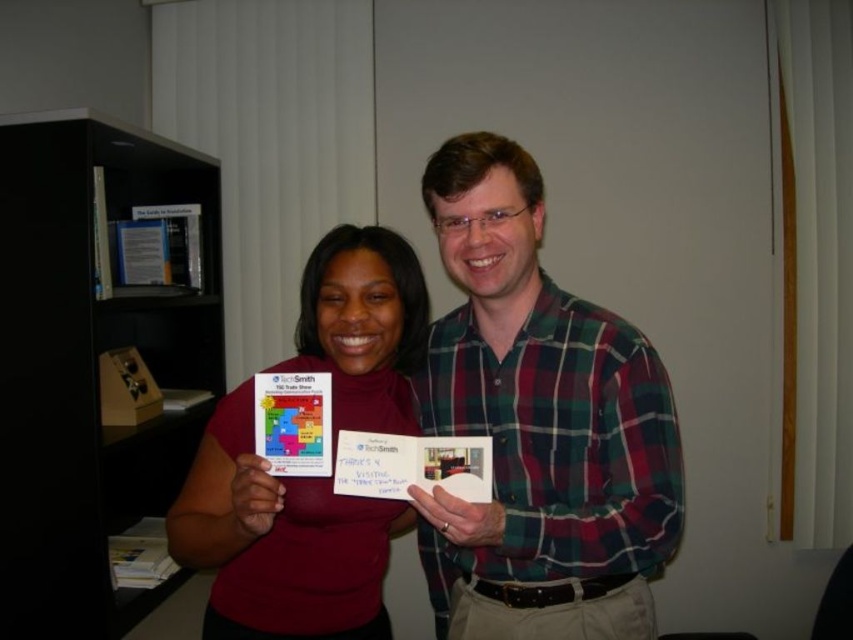
Question: From the image, what is the correct spatial relationship of plaid shirt at center in relation to white paper at center?

Choices:
 (A) below
 (B) above

Answer: (B)

Question: Does plaid shirt at center lie behind white paper at center?

Choices:
 (A) no
 (B) yes

Answer: (A)

Question: Which point is closer to the camera taking this photo?

Choices:
 (A) (358, 321)
 (B) (399, 493)
 (C) (267, 449)

Answer: (B)

Question: Estimate the real-world distances between objects in this image. Which object is farther from the matte plastic card at center?

Choices:
 (A) matte red shirt at center
 (B) white paper at center
 (C) plaid shirt at center

Answer: (C)

Question: Can you confirm if white paper at center is thinner than matte plastic card at center?

Choices:
 (A) no
 (B) yes

Answer: (A)

Question: Which point is farther from the camera taking this photo?

Choices:
 (A) (276, 404)
 (B) (415, 445)

Answer: (A)